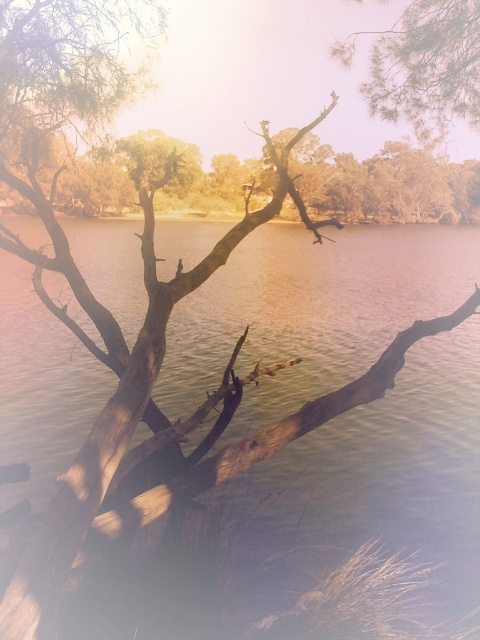
Question: In this image, where is brown matte water at center located relative to green textured pine branch at upper right?

Choices:
 (A) above
 (B) below

Answer: (B)

Question: Observing the image, what is the correct spatial positioning of brown matte water at center in reference to green textured pine branch at upper right?

Choices:
 (A) right
 (B) left

Answer: (A)

Question: Among these objects, which one is nearest to the camera?

Choices:
 (A) green textured pine branch at upper right
 (B) brown matte water at center

Answer: (B)

Question: Which point appears closest to the camera in this image?

Choices:
 (A) (460, 406)
 (B) (412, 67)

Answer: (B)

Question: Can you confirm if brown matte water at center is positioned to the right of green textured pine branch at upper right?

Choices:
 (A) yes
 (B) no

Answer: (A)